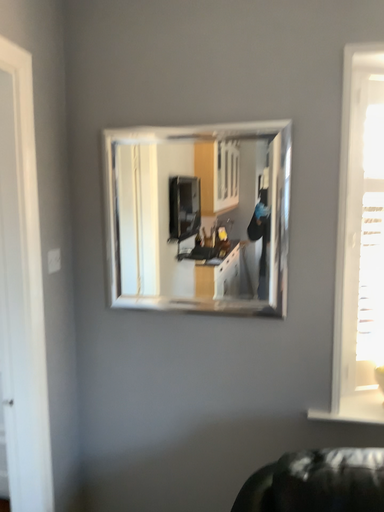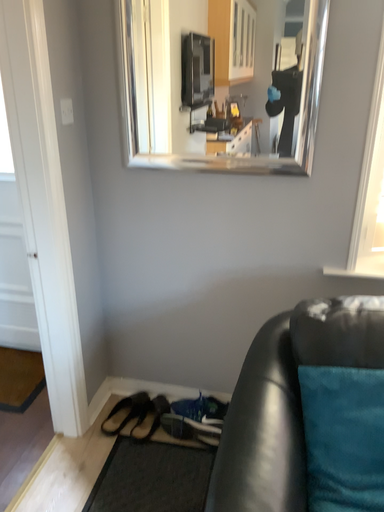
Question: Which way did the camera rotate in the video?

Choices:
 (A) rotated downward
 (B) rotated upward

Answer: (A)